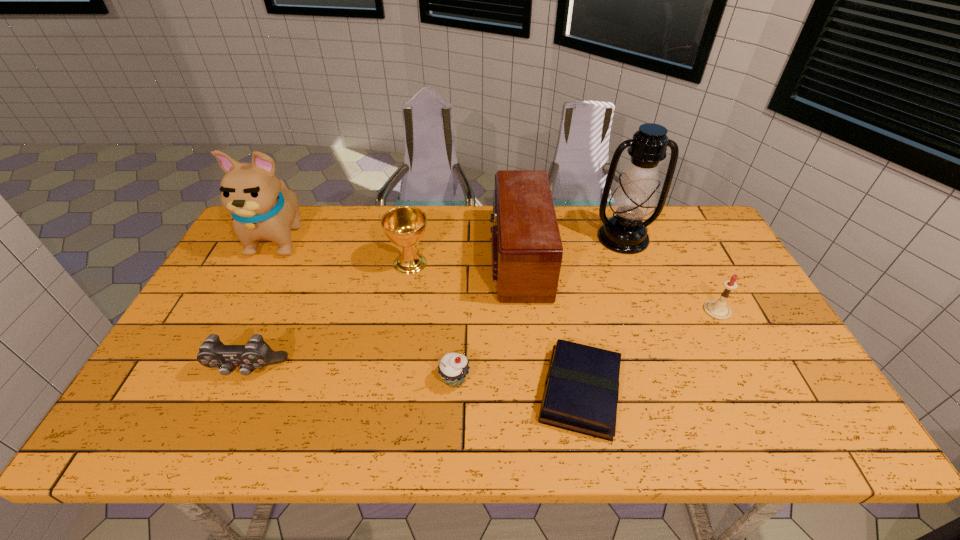
The width and height of the screenshot is (960, 540). I want to click on free space that satisfies the following two spatial constraints: 1. on the front-facing side of the radio receiver; 2. on the surface of the control with buttons, so click(x=529, y=370).